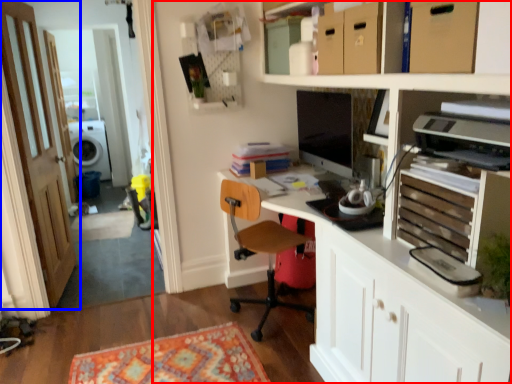
Question: Which of the following is the closest to the observer, entertainment center (highlighted by a red box) or door (highlighted by a blue box)?

Choices:
 (A) entertainment center
 (B) door

Answer: (A)